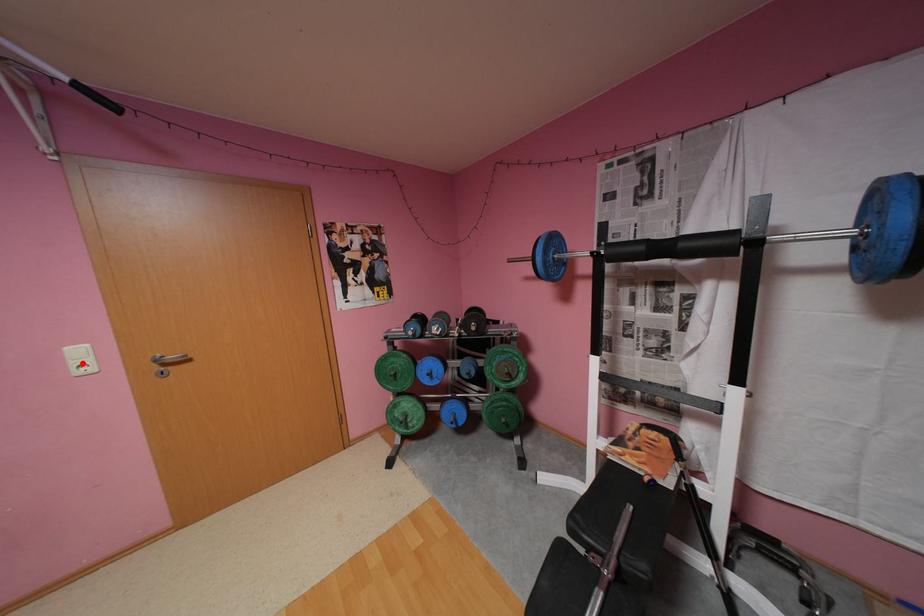
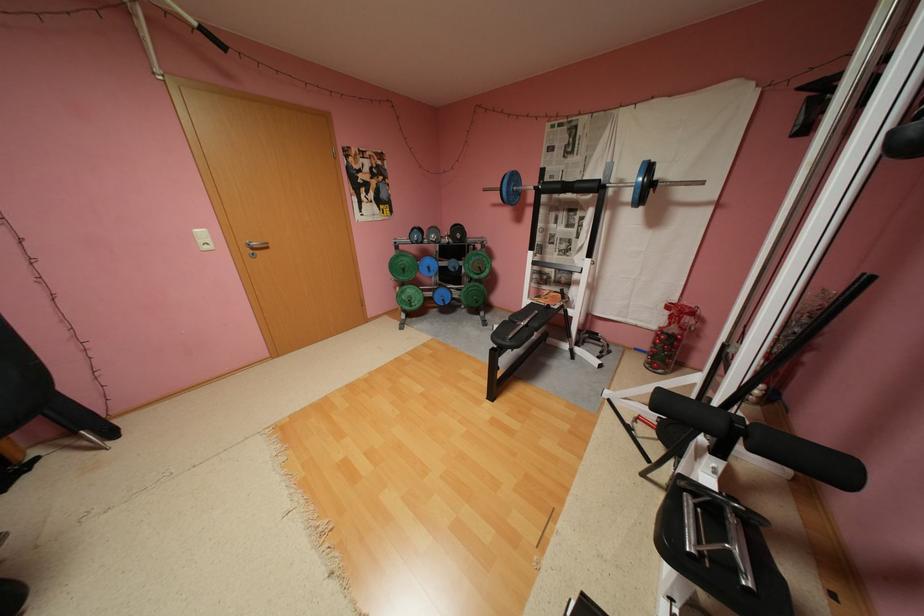
Where in the second image is the point corresponding to the highlighted location from the first image?

(210, 241)